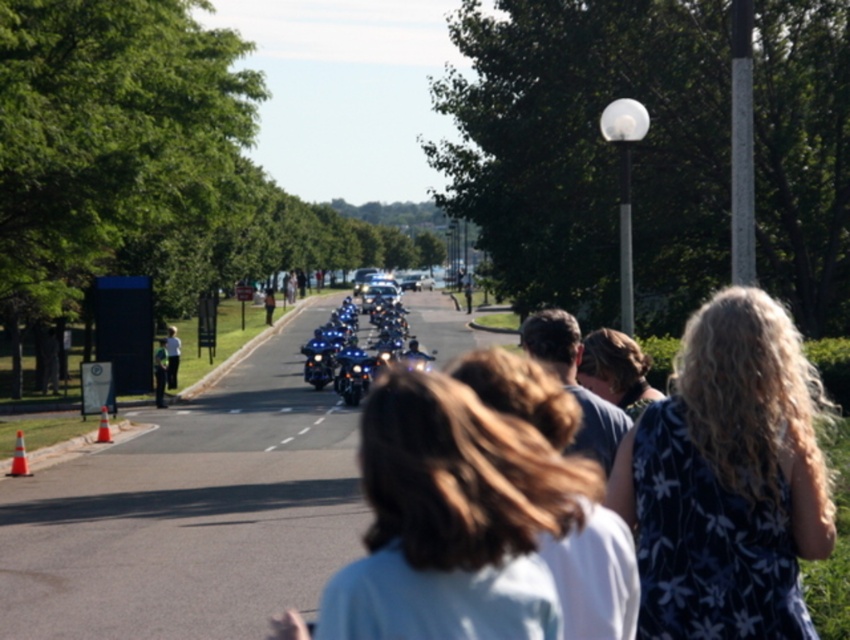
Question: Which object appears closest to the camera in this image?

Choices:
 (A) shiny chrome motorcycle at center
 (B) dark floral dress at center
 (C) white dashed line at center

Answer: (B)

Question: Which point appears farthest from the camera in this image?

Choices:
 (A) (697, 332)
 (B) (344, 401)
 (C) (309, 428)

Answer: (B)

Question: Is dark floral dress at center further to camera compared to white dashed line at center?

Choices:
 (A) no
 (B) yes

Answer: (A)

Question: From the image, what is the correct spatial relationship of dark floral dress at center in relation to shiny chrome motorcycle at center?

Choices:
 (A) above
 (B) below

Answer: (A)

Question: Is the position of shiny blue motorcycle at center less distant than that of white dashed line at center?

Choices:
 (A) no
 (B) yes

Answer: (A)

Question: Which point is farther to the camera?

Choices:
 (A) white dashed line at center
 (B) shiny blue motorcycle at center
 (C) shiny chrome motorcycle at center

Answer: (C)